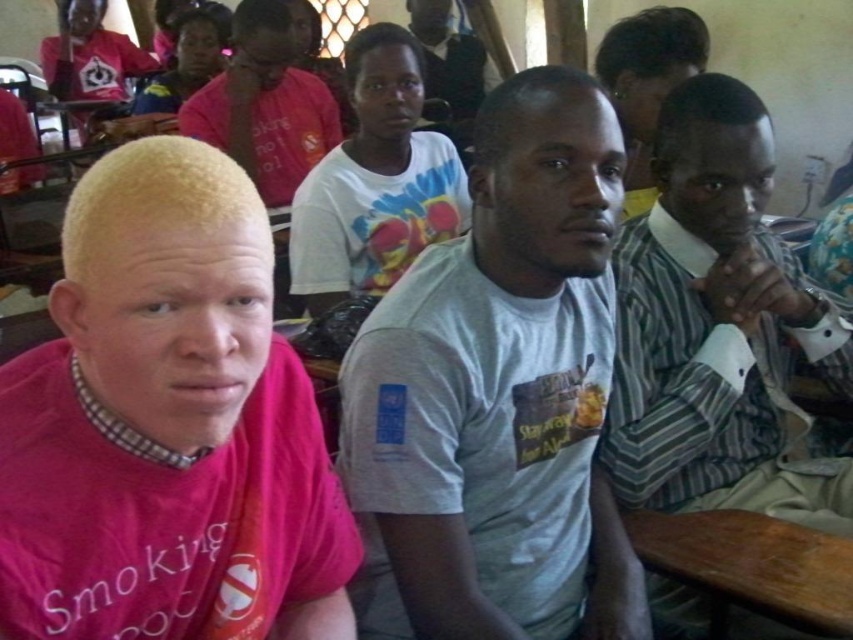
In the scene shown: You are sitting at the wooden table at lower right and want to hand a document to the person wearing the striped fabric shirt at right. Can you reach them without leaving your seat?

The wooden table at lower right is behind the striped fabric shirt at right, so you are sitting behind them. You can reach them by passing the document over the table or around the side depending on the distance between you.

You are a photographer adjusting your camera settings. You need to focus on both the striped fabric shirt at right and the pink matte shirt at upper center. Which shirt should you adjust your focus to first to ensure both are in sharp focus?

You should focus on the striped fabric shirt at right first because it is closer to the viewer than the pink matte shirt at upper center. By focusing on the closer object, the depth of field will naturally include the farther object in acceptable sharpness.